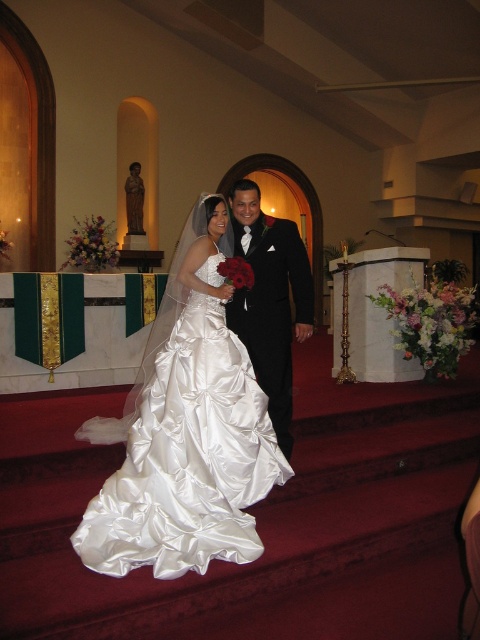
Question: Which point is farther to the camera?

Choices:
 (A) (135, 472)
 (B) (236, 237)

Answer: (B)

Question: Among these points, which one is nearest to the camera?

Choices:
 (A) (183, 417)
 (B) (248, 257)

Answer: (A)

Question: Where is satin dress at center located in relation to shiny black suit at center in the image?

Choices:
 (A) right
 (B) left

Answer: (B)

Question: Does satin dress at center appear on the left side of shiny black suit at center?

Choices:
 (A) no
 (B) yes

Answer: (B)

Question: Is satin dress at center smaller than shiny black suit at center?

Choices:
 (A) no
 (B) yes

Answer: (A)